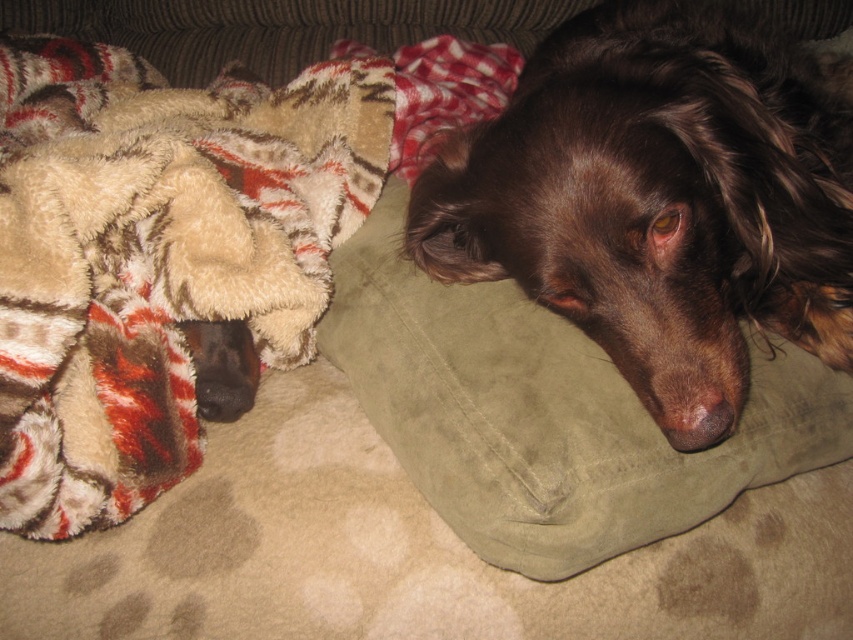
Can you confirm if brown velvet dog at center is smaller than suede pillow at center?

No.

Which is behind, point (558, 285) or point (567, 536)?

The point (558, 285) is behind.

This screenshot has width=853, height=640. Identify the location of brown velvet dog at center. (660, 198).

Who is more forward, [115,305] or [664,148]?

Positioned in front is point [664,148].

The image size is (853, 640). Describe the element at coordinates (155, 256) in the screenshot. I see `fuzzy beige blanket at left` at that location.

Locate an element on the screen. fuzzy beige blanket at left is located at coordinates (155, 256).

Does fuzzy beige blanket at left lie in front of suede pillow at center?

No, it is not.

Which is more to the left, fuzzy beige blanket at left or suede pillow at center?

fuzzy beige blanket at left is more to the left.

Identify the location of fuzzy beige blanket at left. click(x=155, y=256).

You are a GUI agent. You are given a task and a screenshot of the screen. Output one action in this format:
    pyautogui.click(x=<x>, y=<y>)
    Task: Click on the fuzzy beige blanket at left
    
    Given the screenshot: What is the action you would take?
    pyautogui.click(x=155, y=256)